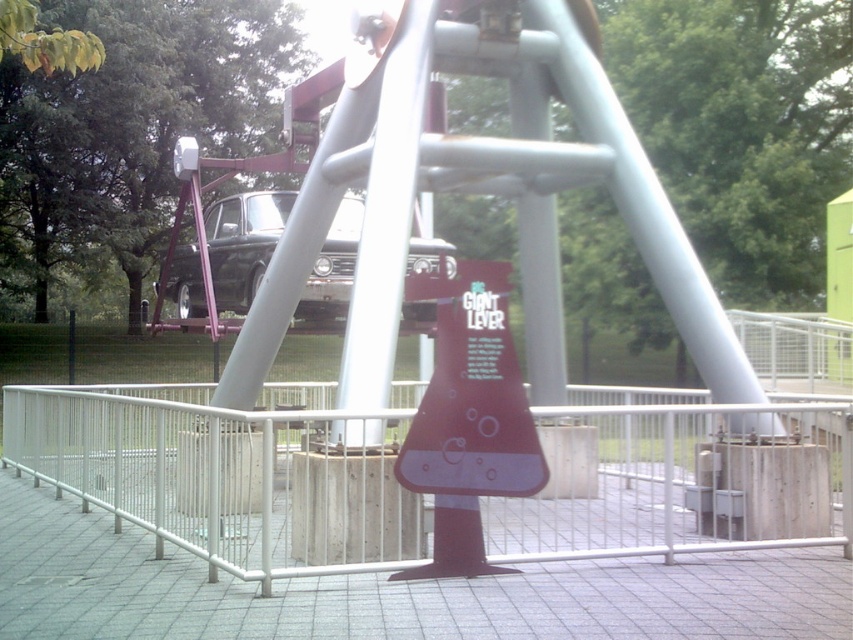
Question: Which object is farther from the camera taking this photo?

Choices:
 (A) matte purple sign at center
 (B) shiny black car at center

Answer: (B)

Question: In this image, where is white metal fence at center located relative to matte purple sign at center?

Choices:
 (A) above
 (B) below

Answer: (B)

Question: Among these points, which one is nearest to the camera?

Choices:
 (A) (346, 237)
 (B) (494, 420)
 (C) (149, 416)

Answer: (B)

Question: Among these objects, which one is nearest to the camera?

Choices:
 (A) shiny black car at center
 (B) matte purple sign at center

Answer: (B)

Question: Is matte purple sign at center to the left of shiny black car at center from the viewer's perspective?

Choices:
 (A) no
 (B) yes

Answer: (A)

Question: Can you confirm if white metal fence at center is positioned below shiny black car at center?

Choices:
 (A) no
 (B) yes

Answer: (B)